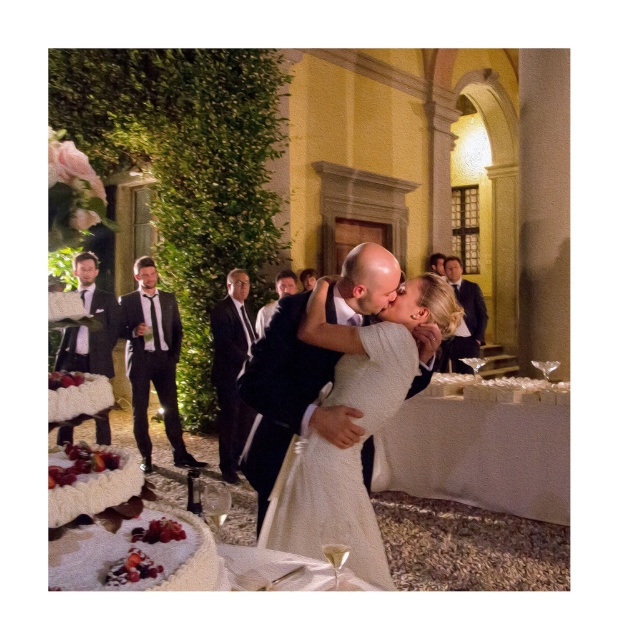
Between black suit at center and shiny black suit at left, which one is positioned lower?

Positioned lower is black suit at center.

Is black suit at center to the left of shiny black suit at left from the viewer's perspective?

Incorrect, black suit at center is not on the left side of shiny black suit at left.

Does point (238, 273) come farther from viewer compared to point (100, 440)?

No, it is in front of (100, 440).

You are a GUI agent. You are given a task and a screenshot of the screen. Output one action in this format:
    pyautogui.click(x=<x>, y=<y>)
    Task: Click on the black suit at center
    The height and width of the screenshot is (640, 619).
    Given the screenshot: What is the action you would take?
    pyautogui.click(x=230, y=369)

Based on the photo, is white satin cake at lower left to the right of dark suit at center from the viewer's perspective?

Indeed, white satin cake at lower left is positioned on the right side of dark suit at center.

The height and width of the screenshot is (640, 619). What do you see at coordinates (404, 172) in the screenshot? I see `white satin cake at lower left` at bounding box center [404, 172].

Identify the location of white satin cake at lower left. The image size is (619, 640). (404, 172).

Consider the image. Is white textured cake at lower left behind matte black suit at upper right?

That is False.

Measure the distance between point (63, 544) and camera.

4.73 feet

The width and height of the screenshot is (619, 640). In order to click on white textured cake at lower left in this screenshot , I will do `click(142, 550)`.